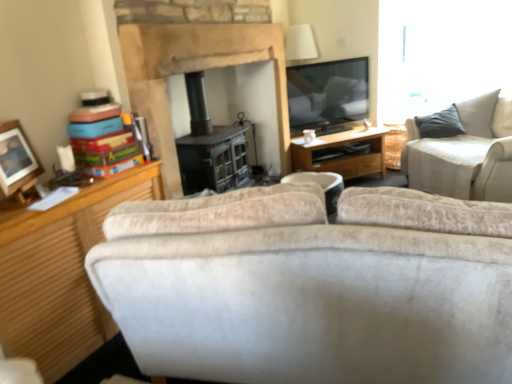
Question: Visually, is wooden photo frame at left positioned to the left or to the right of beige fabric couch at upper right?

Choices:
 (A) right
 (B) left

Answer: (B)

Question: In terms of height, does wooden photo frame at left look taller or shorter compared to beige fabric couch at upper right?

Choices:
 (A) tall
 (B) short

Answer: (B)

Question: Which is nearer to the beige fabric couch at upper right?

Choices:
 (A) wooden desk at center
 (B) stone fireplace at center
 (C) wooden photo frame at left
 (D) white ceramic coffee cup at center
 (E) white fabric trash bin/can at center

Answer: (A)

Question: Considering the real-world distances, which object is farthest from the white fabric trash bin/can at center?

Choices:
 (A) wooden photo frame at left
 (B) beige fabric couch at upper right
 (C) white ceramic coffee cup at center
 (D) wooden desk at center
 (E) stone fireplace at center

Answer: (C)